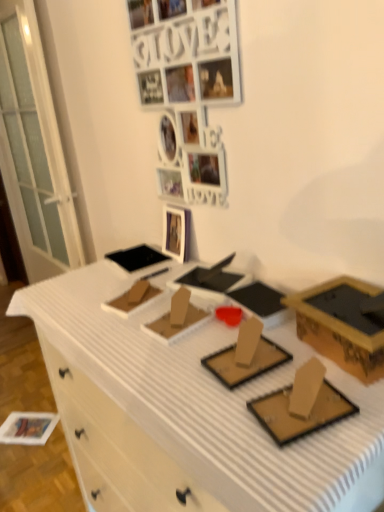
Question: From the image's perspective, is white matte photo frame at upper center above or below gold cardboard box at right?

Choices:
 (A) below
 (B) above

Answer: (B)

Question: Considering their positions, is white matte photo frame at upper center located in front of or behind gold cardboard box at right?

Choices:
 (A) behind
 (B) front

Answer: (A)

Question: Considering the real-world distances, which object is closest to the gold cardboard box at right?

Choices:
 (A) white matte photo frame at upper center
 (B) white glossy picture frame at upper center
 (C) white matte drawer at lower left
 (D) white cardboard desk at center

Answer: (D)

Question: Based on their relative distances, which object is nearer to the white glossy picture frame at upper center?

Choices:
 (A) white matte photo frame at upper center
 (B) gold cardboard box at right
 (C) white matte drawer at lower left
 (D) white cardboard desk at center

Answer: (A)